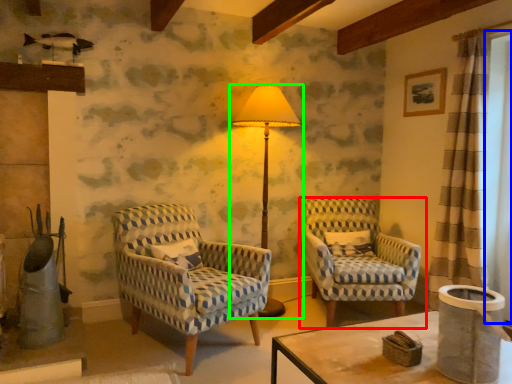
Question: Which object is the closest to the chair (highlighted by a red box)? Choose among these: window screen (highlighted by a blue box) or lamp (highlighted by a green box).

Choices:
 (A) window screen
 (B) lamp

Answer: (B)